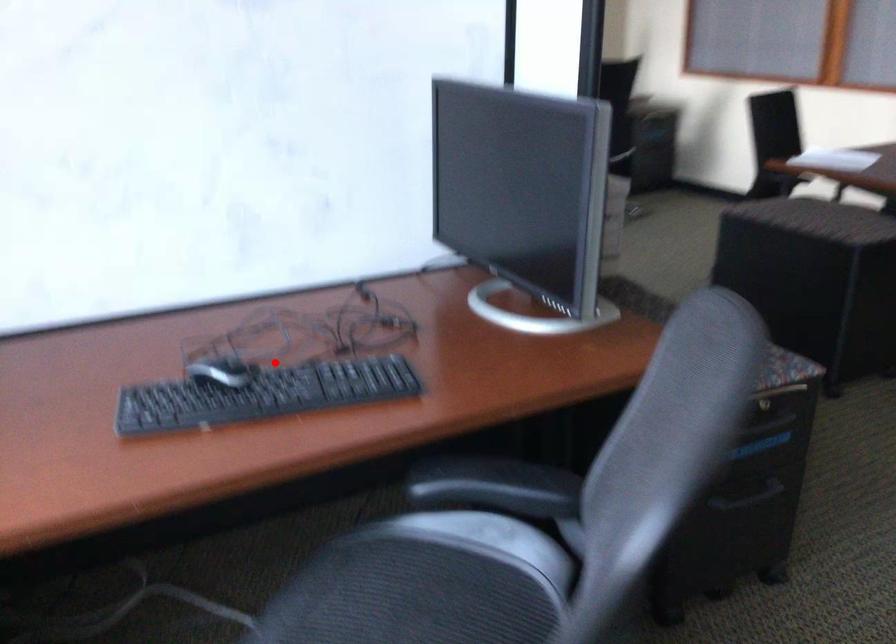
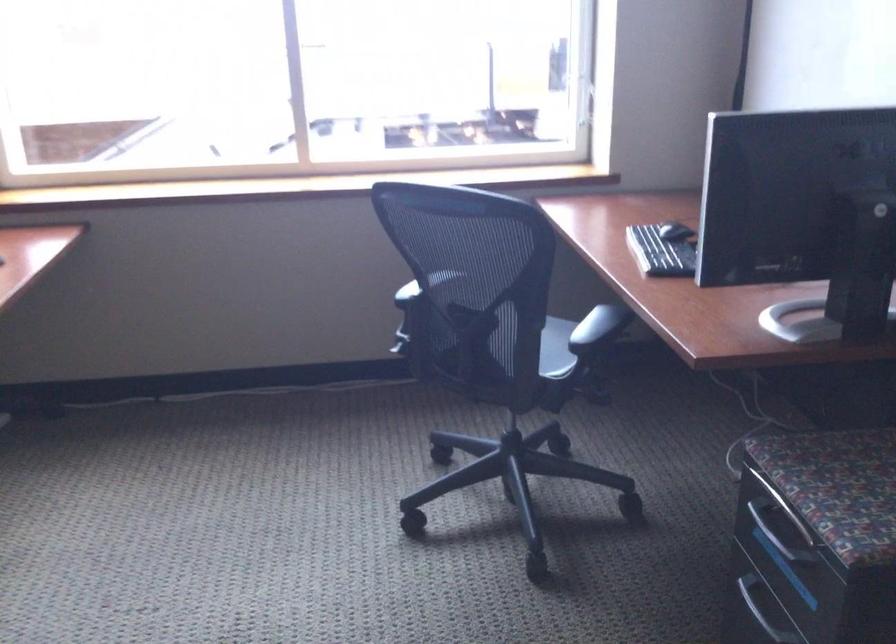
The point at the highlighted location is marked in the first image. Where is the corresponding point in the second image?

(676, 231)